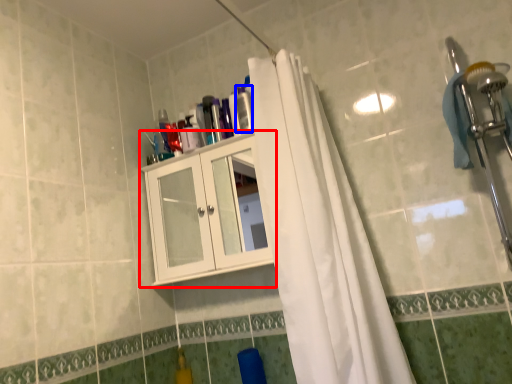
Question: Which point is closer to the camera, cabinetry (highlighted by a red box) or toiletry (highlighted by a blue box)?

Choices:
 (A) cabinetry
 (B) toiletry

Answer: (A)